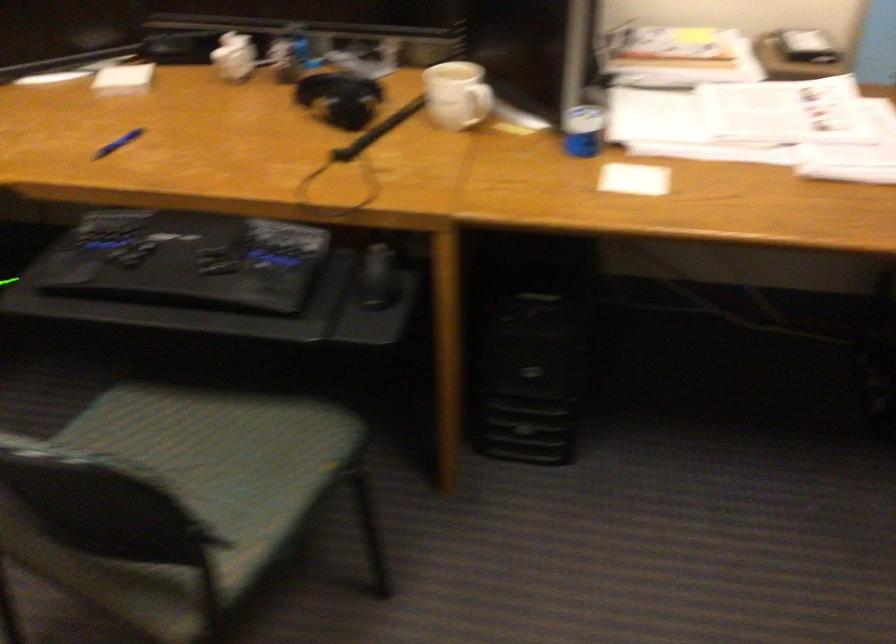
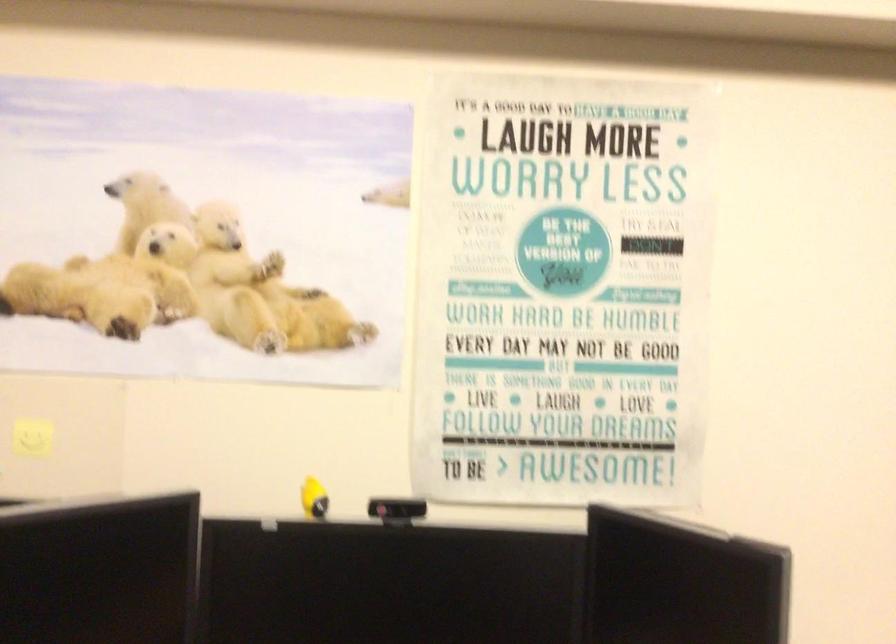
Question: Based on the continuous images, in which direction is the camera rotating? Reply with the corresponding letter.

Choices:
 (A) Left
 (B) Right
 (C) Up
 (D) Down

Answer: (C)